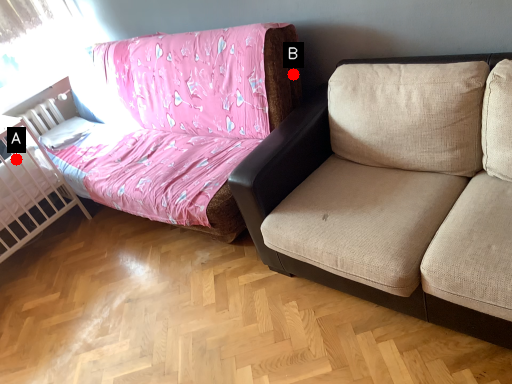
Question: Two points are circled on the image, labeled by A and B beside each circle. Which point is farther to the camera?

Choices:
 (A) A is further
 (B) B is further

Answer: (A)